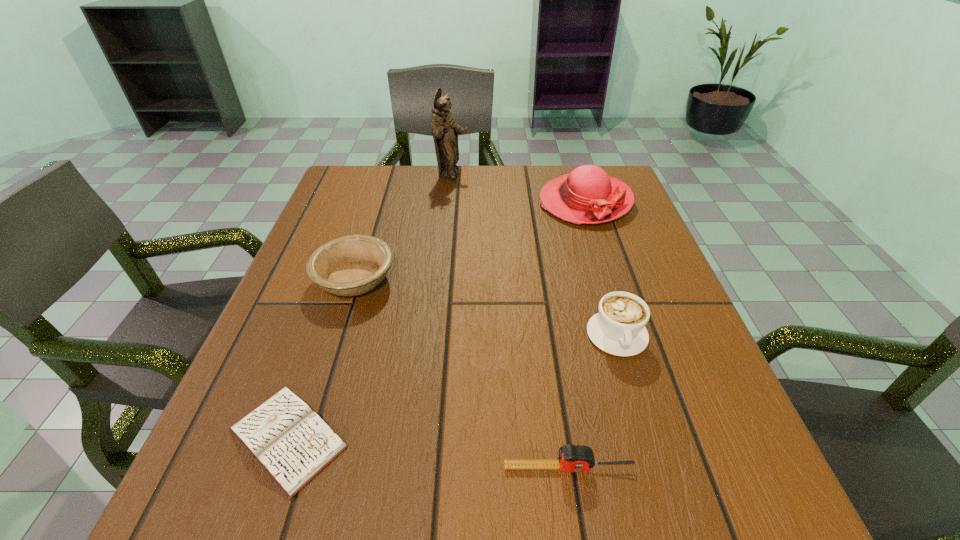
Identify the location of diary that is positioned at the left edge. The height and width of the screenshot is (540, 960). (293, 444).

Find the location of a particular element. Image resolution: width=960 pixels, height=540 pixels. hat that is at the right edge is located at coordinates (587, 195).

The image size is (960, 540). I want to click on cappuccino that is at the right edge, so click(619, 328).

I want to click on object located at the near left corner, so click(x=293, y=444).

Where is `object present at the far right corner`? object present at the far right corner is located at coordinates (587, 195).

In the image, there is a desktop. Find the location of `vacant space at the far edge`. vacant space at the far edge is located at coordinates (472, 175).

This screenshot has height=540, width=960. Identify the location of vacant point at the near edge. pyautogui.click(x=335, y=487).

Where is `blank area at the left edge`? The width and height of the screenshot is (960, 540). blank area at the left edge is located at coordinates (310, 230).

The height and width of the screenshot is (540, 960). In the image, there is a desktop. Identify the location of vacant region at the right edge. (681, 322).

In the image, there is a desktop. At what (x,y) coordinates should I click in order to perform the action: click on vacant area at the far left corner. Please return your answer as a coordinate pair (x, y). Looking at the image, I should click on pos(358,184).